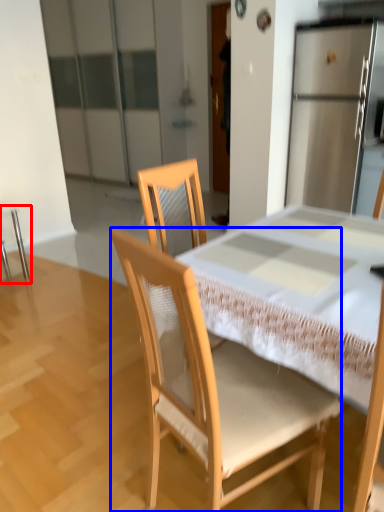
Question: Which object appears farthest to the camera in this image, chair (highlighted by a red box) or chair (highlighted by a blue box)?

Choices:
 (A) chair
 (B) chair

Answer: (A)